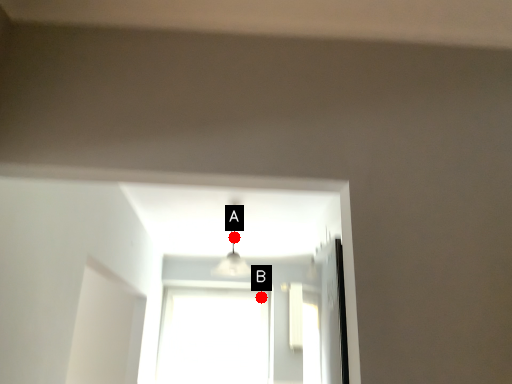
Question: Two points are circled on the image, labeled by A and B beside each circle. Which point is farther from the camera taking this photo?

Choices:
 (A) A is further
 (B) B is further

Answer: (B)